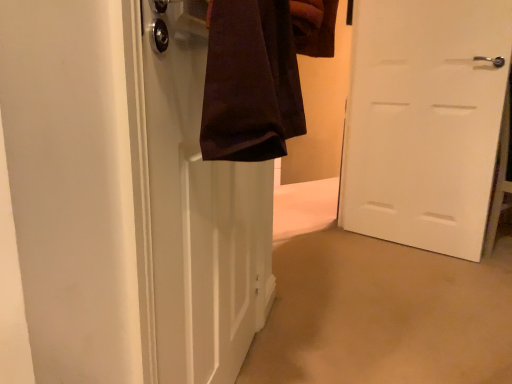
Where is `white matte door at center`? This screenshot has height=384, width=512. white matte door at center is located at coordinates (424, 121).

This screenshot has height=384, width=512. What do you see at coordinates (424, 121) in the screenshot?
I see `white matte door at center` at bounding box center [424, 121].

This screenshot has width=512, height=384. Identify the location of white matte door at center. (424, 121).